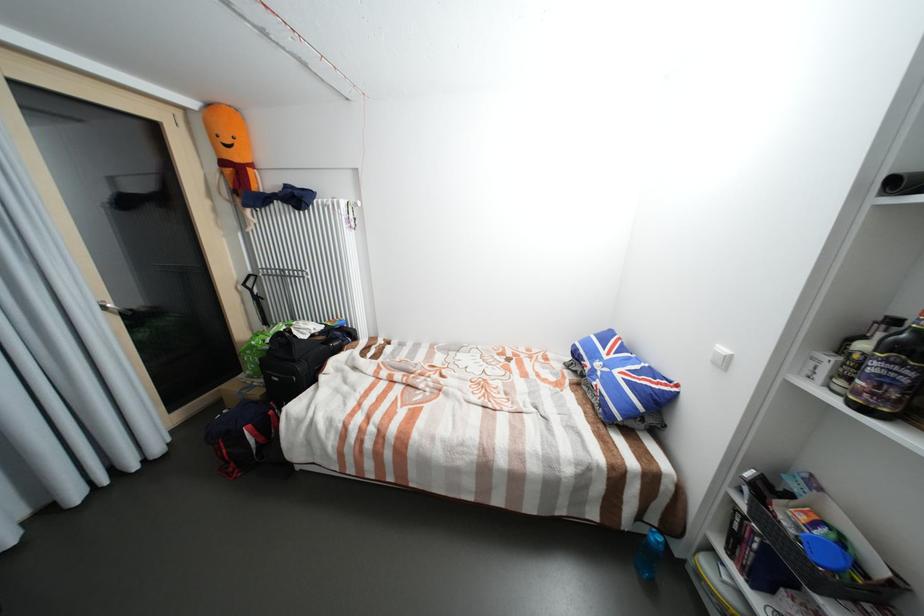
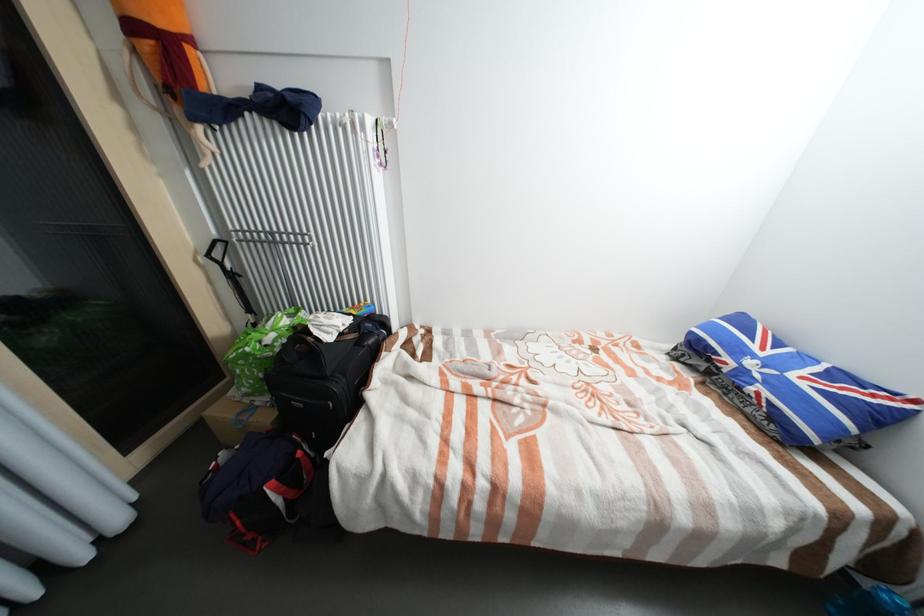
The point at (256, 377) is marked in the first image. Where is the corresponding point in the second image?

(253, 395)